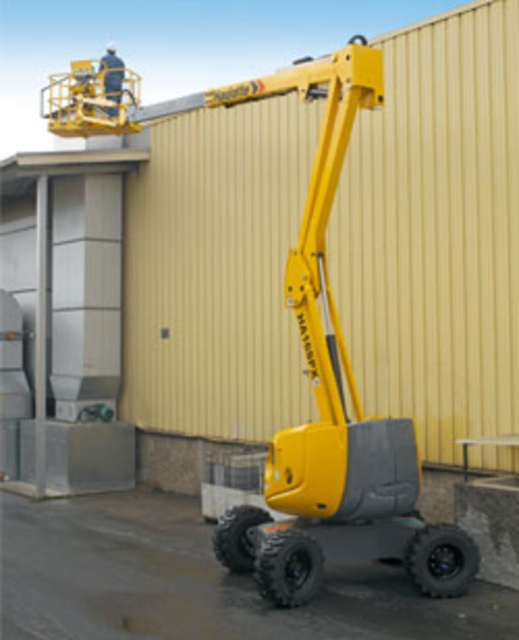
How far apart are yellow matte forklift at center and white fabric construction worker at upper center?

The distance of yellow matte forklift at center from white fabric construction worker at upper center is 25.51 feet.

In order to click on yellow matte forklift at center in this screenshot , I will do `click(334, 400)`.